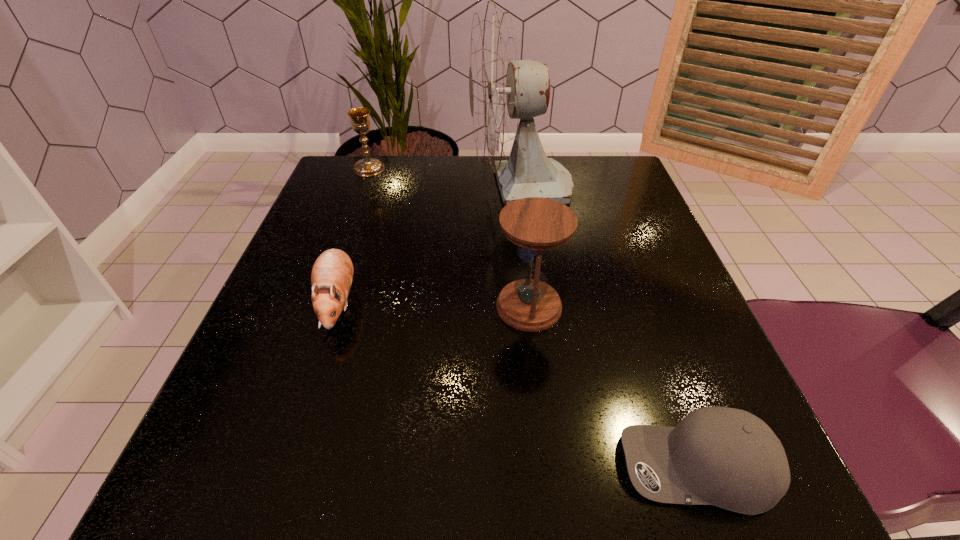
At what (x,y) coordinates should I click in order to perform the action: click on baseball cap present at the right edge. Please return your answer as a coordinate pair (x, y). Looking at the image, I should click on (729, 458).

This screenshot has height=540, width=960. I want to click on object that is at the far left corner, so click(360, 121).

Locate an element on the screen. This screenshot has height=540, width=960. object positioned at the far right corner is located at coordinates (502, 89).

Where is `object located in the near right corner section of the desktop`? object located in the near right corner section of the desktop is located at coordinates (729, 458).

The image size is (960, 540). Identify the location of free spot at the far edge of the desktop. (409, 202).

In the image, there is a desktop. Where is `vacant space at the near edge`? This screenshot has height=540, width=960. vacant space at the near edge is located at coordinates (469, 482).

In the image, there is a desktop. Identify the location of vacant space at the left edge. (277, 314).

Locate an element on the screen. blank space at the right edge of the desktop is located at coordinates (652, 328).

Identify the location of vacant area at the far left corner of the desktop. (386, 164).

In order to click on vacant area at the near left corner in this screenshot , I will do `click(210, 492)`.